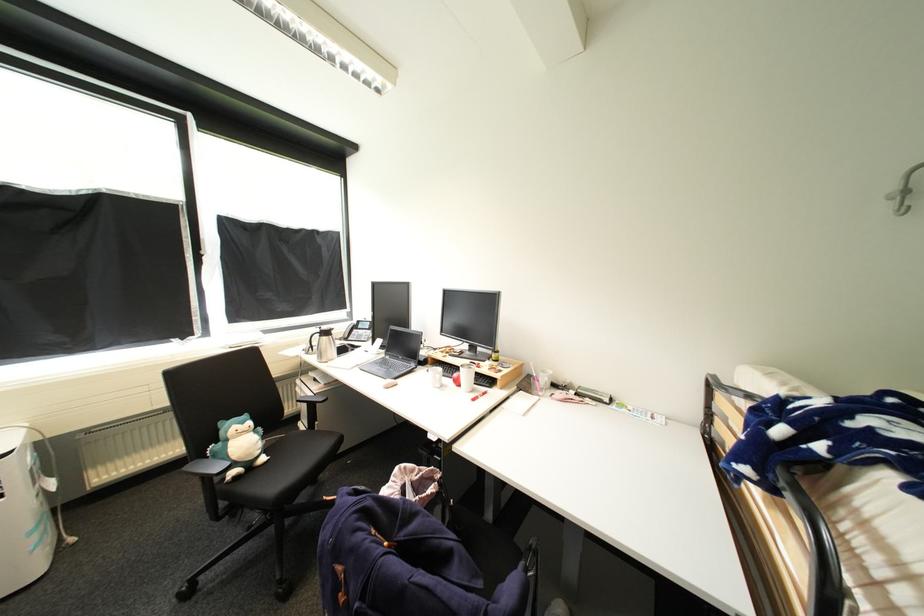
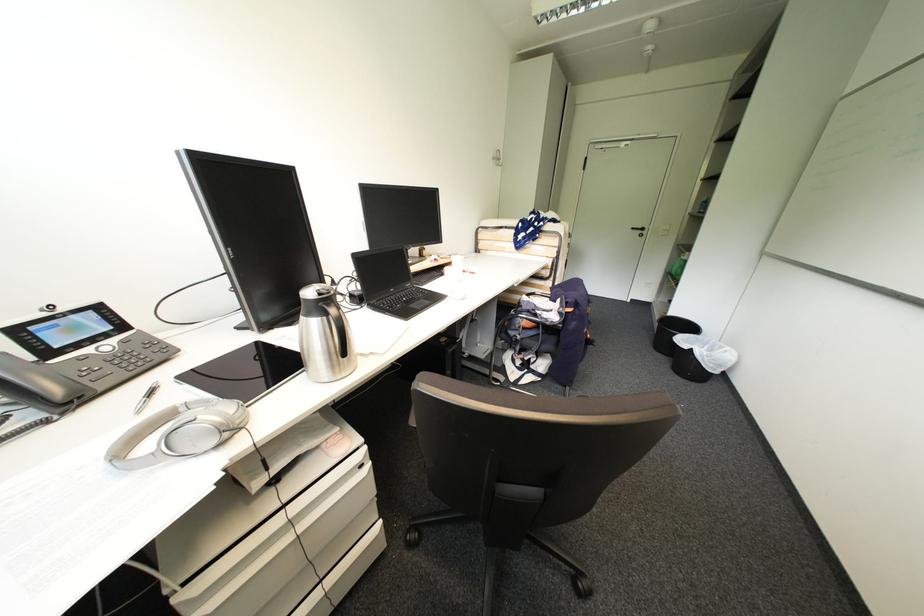
Question: I am providing you with two images of the same scene from different viewpoints. After the viewpoint changes to image2, which objects are now occluded?

Choices:
 (A) thermos handle
 (B) black chair surface
 (C) metal cabinet latch
 (D) silver pen

Answer: (B)